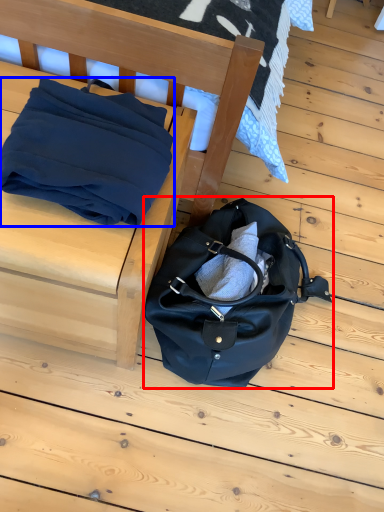
Question: Which object is closer to the camera taking this photo, handbag (highlighted by a red box) or blanket (highlighted by a blue box)?

Choices:
 (A) handbag
 (B) blanket

Answer: (B)